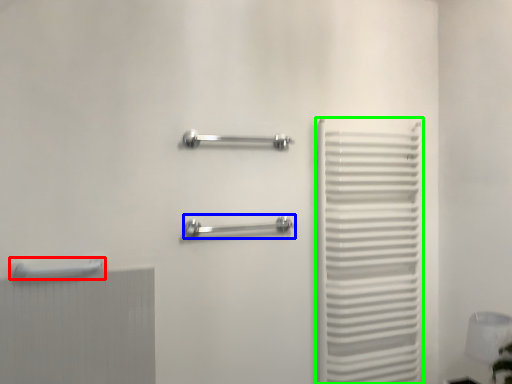
Question: Estimate the real-world distances between objects in this image. Which object is closer to towel rack (highlighted by a red box), towel rack (highlighted by a blue box) or curtain (highlighted by a green box)?

Choices:
 (A) towel rack
 (B) curtain

Answer: (A)